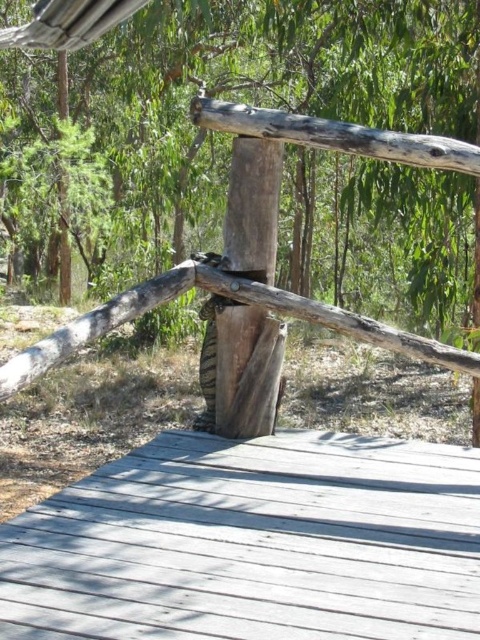
Question: Among these objects, which one is nearest to the camera?

Choices:
 (A) smooth gray wood deck at center
 (B) weathered wood post at center

Answer: (A)

Question: Is smooth gray wood deck at center in front of weathered wood post at center?

Choices:
 (A) yes
 (B) no

Answer: (A)

Question: Which point is farther to the camera?

Choices:
 (A) (253, 458)
 (B) (230, 416)

Answer: (B)

Question: Is smooth gray wood deck at center in front of weathered wood post at center?

Choices:
 (A) yes
 (B) no

Answer: (A)

Question: Does smooth gray wood deck at center appear on the left side of weathered wood post at center?

Choices:
 (A) no
 (B) yes

Answer: (B)